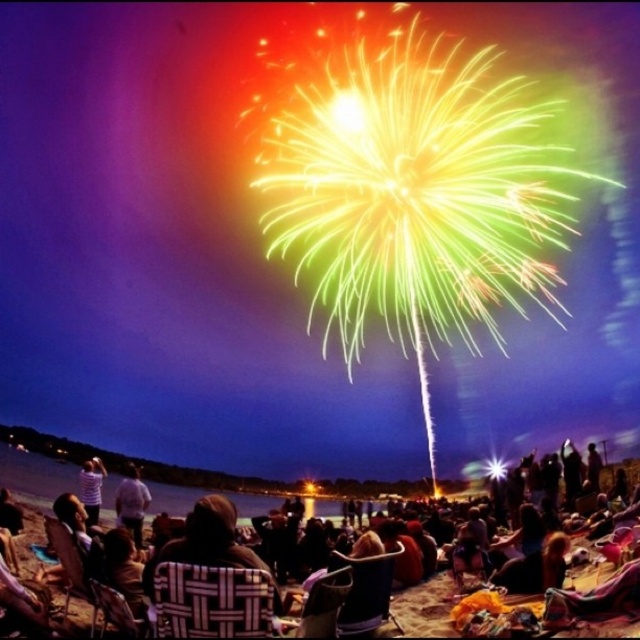
Question: Can you confirm if dark brown leather jacket at center is bigger than striped shirt at lower left?

Choices:
 (A) no
 (B) yes

Answer: (B)

Question: Considering the real-world distances, which object is farthest from the white cotton shirt at lower left?

Choices:
 (A) dark brown leather jacket at center
 (B) striped shirt at lower left

Answer: (B)

Question: Which of the following is the closest to the observer?

Choices:
 (A) (65, 472)
 (B) (144, 512)
 (C) (80, 483)

Answer: (B)

Question: Is white cotton shirt at lower left wider than striped shirt at lower left?

Choices:
 (A) yes
 (B) no

Answer: (A)

Question: Which object is positioned closest to the dark brown leather jacket at center?

Choices:
 (A) striped shirt at lower left
 (B) white cotton shirt at lower left

Answer: (B)

Question: In this image, where is dark brown leather jacket at center located relative to white cotton shirt at lower left?

Choices:
 (A) left
 (B) right

Answer: (B)